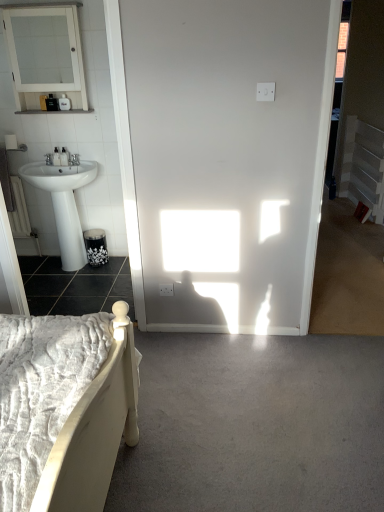
Question: Considering their positions, is white plastic balustrade at right located in front of or behind matte black soap dispenser at left, which appears as the 2th toiletry when ordered from the bottom?

Choices:
 (A) behind
 (B) front

Answer: (A)

Question: In terms of size, does white plastic balustrade at right appear bigger or smaller than matte black soap dispenser at left, which appears as the 2th toiletry when ordered from the bottom?

Choices:
 (A) big
 (B) small

Answer: (A)

Question: Considering the real-world distances, which object is farthest from the matte black soap dispenser at left, positioned as the 1th toiletry in bottom-to-top order?

Choices:
 (A) white plastic balustrade at right
 (B) black glossy concrete at lower left, which appears as the 1th concrete when viewed from the top
 (C) matte black soap dispenser at upper left, which appears as the third toiletry when ordered from the bottom
 (D) gray carpet at lower center, arranged as the second concrete when viewed from the top
 (E) matte black soap dispenser at left, which ranks as the second toiletry in top-to-bottom order

Answer: (A)

Question: Which object is the farthest from the gray carpet at lower center, arranged as the second concrete when viewed from the top?

Choices:
 (A) matte black soap dispenser at left, which appears as the third toiletry when viewed from the top
 (B) matte black soap dispenser at left, which ranks as the second toiletry in top-to-bottom order
 (C) white glossy medicine cabinet at upper left
 (D) white glossy pedestal sink at left
 (E) black glossy concrete at lower left, positioned as the 1th concrete in back-to-front order

Answer: (C)